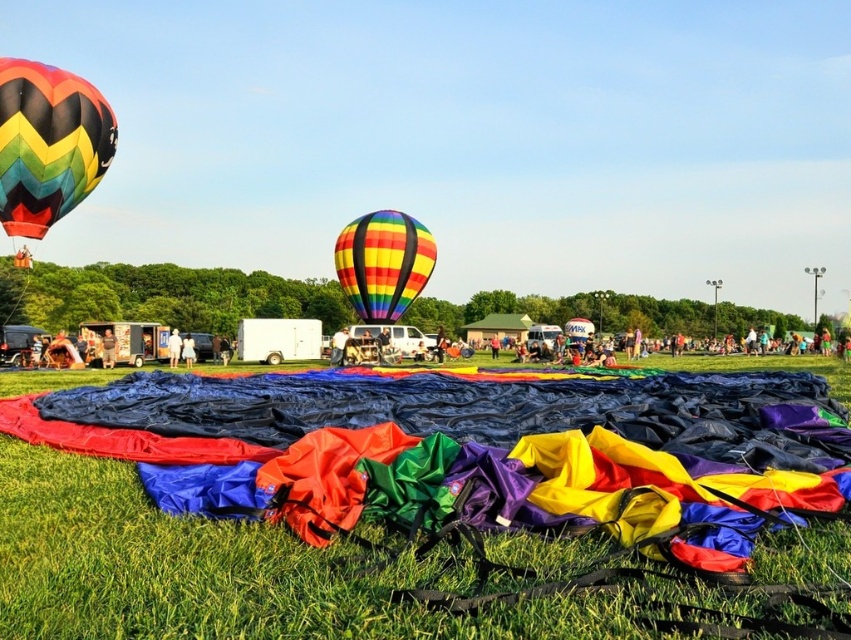
You are standing at the point marked as point (147,561) at the hot air balloon festival. You want to take a photo of the entire scene. Considering your camera has a maximum focus range of 3 meters, will you be able to capture the entire scene in one shot?

The distance between point (147,561) and the camera is 2.89 meters, which is within the camera maximum focus range of 3 meters. Therefore, you can capture the entire scene in one shot.

You are standing at the edge of the hot air balloon festival field. You need to place a small picnic basket on the green grass at lower center. According to the coordinates provided, where exactly should you place it?

The green grass at lower center is located at point [204,572], so you should place the picnic basket there.

You are a photographer planning to take a picture of both the rainbow striped hot air balloon at upper left and the rainbow striped balloon at center. Which balloon should you focus on first to ensure both are in the frame?

You should focus on the rainbow striped balloon at center first because the rainbow striped hot air balloon at upper left is located above it, so adjusting the frame to include the lower balloon ensures the upper one is also captured.